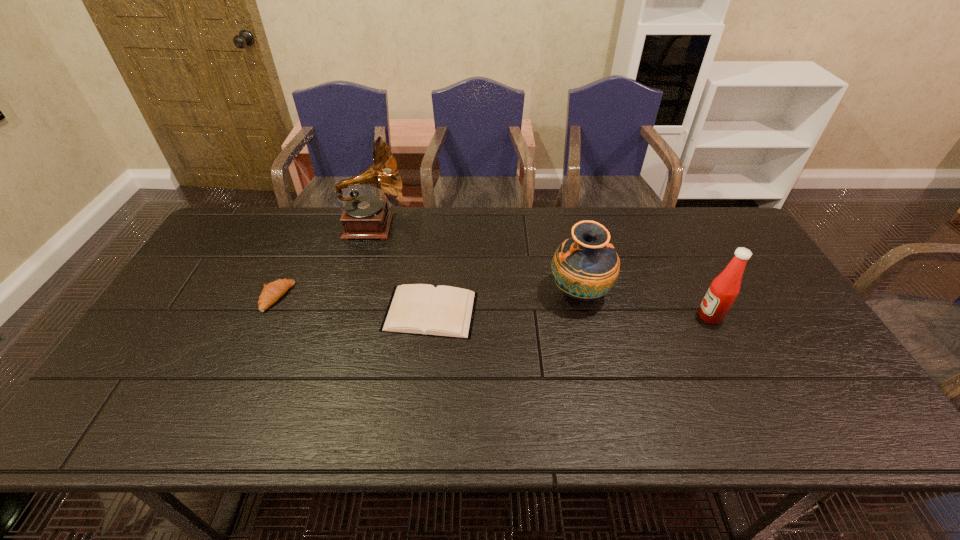
Where is `vacant space at the near right corner of the desktop`? Image resolution: width=960 pixels, height=540 pixels. vacant space at the near right corner of the desktop is located at coordinates (870, 434).

What are the coordinates of `free area in between the rightmost object and the hardback book` in the screenshot? It's located at (570, 314).

Find the location of a particular element. This screenshot has width=960, height=540. blank region between the phonograph_record and the condiment is located at coordinates (541, 271).

Where is `vacant region between the tallest object and the condiment`? Image resolution: width=960 pixels, height=540 pixels. vacant region between the tallest object and the condiment is located at coordinates (541, 271).

Where is `empty space that is in between the rightmost object and the phonograph_record`? empty space that is in between the rightmost object and the phonograph_record is located at coordinates (541, 271).

Identify the location of free area in between the condiment and the leftmost object. The height and width of the screenshot is (540, 960). (493, 307).

Identify the location of free point between the crescent roll and the rightmost object. (493, 307).

Find the location of `free spot between the farthest object and the leftmost object`. free spot between the farthest object and the leftmost object is located at coordinates [x=324, y=261].

At what (x,y) coordinates should I click in order to perform the action: click on vacant space that's between the second shortest object and the shortest object. Please return your answer as a coordinate pair (x, y). Looking at the image, I should click on (353, 305).

At what (x,y) coordinates should I click in order to perform the action: click on free space that is in between the farthest object and the rightmost object. Please return your answer as a coordinate pair (x, y). The image size is (960, 540). Looking at the image, I should click on (541, 271).